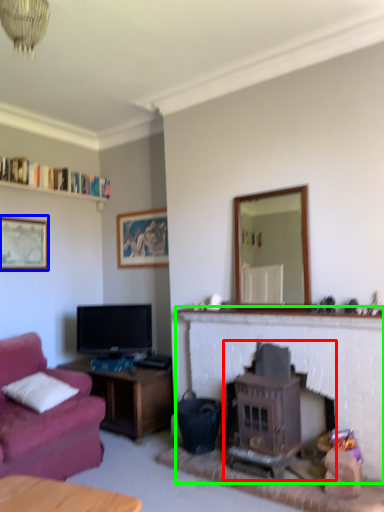
Question: Which is farther away from wood burning stove (highlighted by a red box)? picture frame (highlighted by a blue box) or fireplace (highlighted by a green box)?

Choices:
 (A) picture frame
 (B) fireplace

Answer: (A)